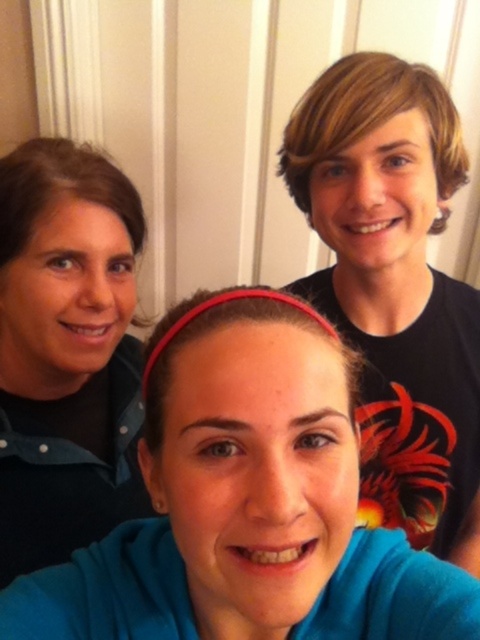
Between point (168, 627) and point (422, 356), which one is positioned in front?

Point (168, 627) is in front.

Does point (168, 410) come in front of point (308, 163)?

Yes, point (168, 410) is in front of point (308, 163).

Is point (279, 570) positioned in front of point (361, 376)?

Yes, point (279, 570) is in front of point (361, 376).

The width and height of the screenshot is (480, 640). Identify the location of blue fleece at center. (247, 502).

Does black matte shirt at upper right come behind matte black shirt at left?

No.

Is point (470, 557) positioned in front of point (12, 460)?

No, (470, 557) is further to viewer.

Where is `black matte shirt at upper right`? This screenshot has width=480, height=640. black matte shirt at upper right is located at coordinates (396, 289).

Identify the location of black matte shirt at upper right. The height and width of the screenshot is (640, 480). (396, 289).

Between blue fleece at center and matte black shirt at left, which one appears on the left side from the viewer's perspective?

Positioned to the left is matte black shirt at left.

Can you confirm if blue fleece at center is positioned to the left of matte black shirt at left?

In fact, blue fleece at center is to the right of matte black shirt at left.

Where is `blue fleece at center`? This screenshot has width=480, height=640. blue fleece at center is located at coordinates (247, 502).

Where is `blue fleece at center`? blue fleece at center is located at coordinates (247, 502).